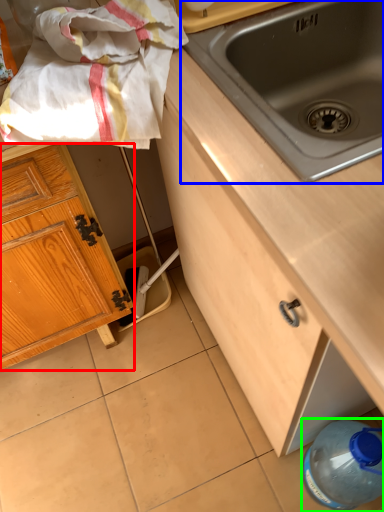
Question: Estimate the real-world distances between objects in this image. Which object is closer to cabinetry (highlighted by a red box), sink (highlighted by a blue box) or bottle (highlighted by a green box)?

Choices:
 (A) sink
 (B) bottle

Answer: (A)